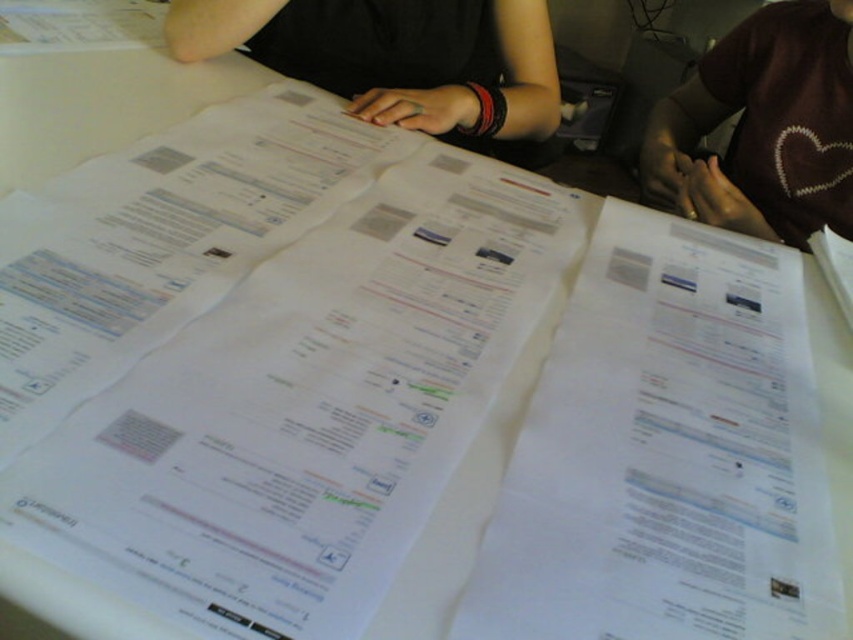
Is point (608, 301) behind point (751, 173)?

No, (608, 301) is in front of (751, 173).

Describe the element at coordinates (666, 452) in the screenshot. Image resolution: width=853 pixels, height=640 pixels. I see `white paper at center` at that location.

Image resolution: width=853 pixels, height=640 pixels. I want to click on white paper at center, so click(666, 452).

Does point (622, 593) come closer to viewer compared to point (397, 96)?

Yes, it is.

Does white paper at center have a larger size compared to black fabric at center?

Yes, white paper at center is bigger than black fabric at center.

Locate an element on the screen. white paper at center is located at coordinates (666, 452).

In the scene shown: Does black fabric at center have a lesser width compared to brown heart-patterned shirt at upper right?

Incorrect, black fabric at center's width is not less than brown heart-patterned shirt at upper right's.

Is point (360, 48) positioned after point (718, 186)?

Yes, point (360, 48) is farther from viewer.

Identify the location of black fabric at center. This screenshot has width=853, height=640. (396, 56).